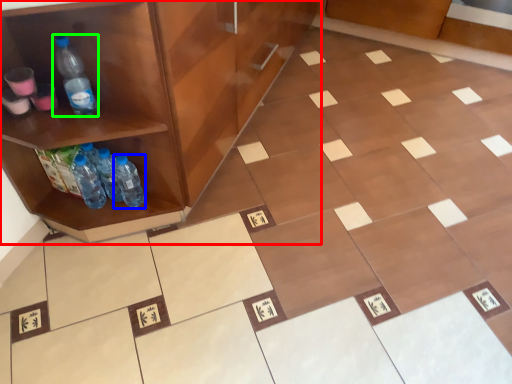
Question: Estimate the real-world distances between objects in this image. Which object is closer to cabinetry (highlighted by a red box), bottle (highlighted by a blue box) or bottle (highlighted by a green box)?

Choices:
 (A) bottle
 (B) bottle

Answer: (B)